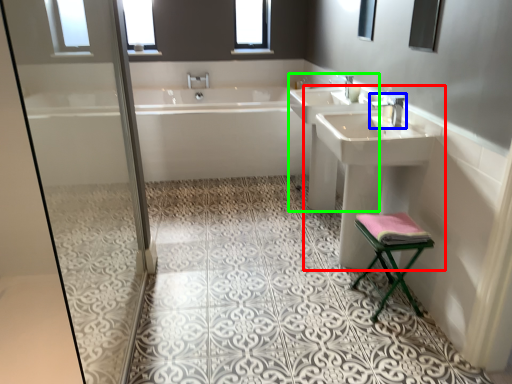
Question: Which is nearer to the sink (highlighted by a red box)? tap (highlighted by a blue box) or sink (highlighted by a green box).

Choices:
 (A) tap
 (B) sink

Answer: (B)